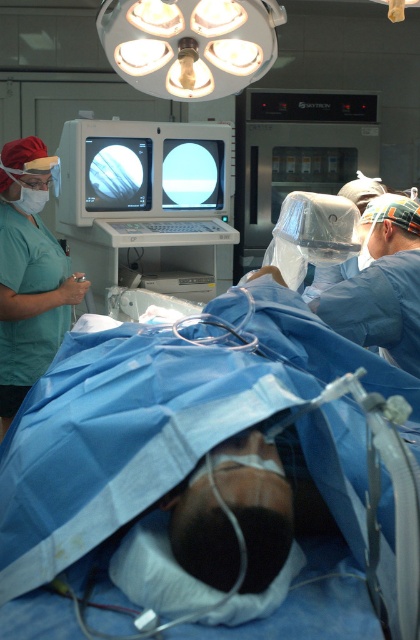
You are a medical student observing an operation. The point marked at coordinates [28,275] is part of an object in the scene. Which object does this point belong to?

The point at coordinates [28,275] belongs to the green scrubs at left.

You are a medical student observing an operation. The attending surgeon asks you to locate the healthcare professional wearing green scrubs at left. Where should you look in the image?

The healthcare professional wearing green scrubs at left is located at point 0.430 on the horizontal axis and 0.069 on the vertical axis.

You are a medical student observing the operating room scene. You notice the green scrubs at left and the matte black monitor at upper center. Which object occupies more horizontal space in the image?

The green scrubs at left occupies more horizontal space than the matte black monitor at upper center because its width is larger.